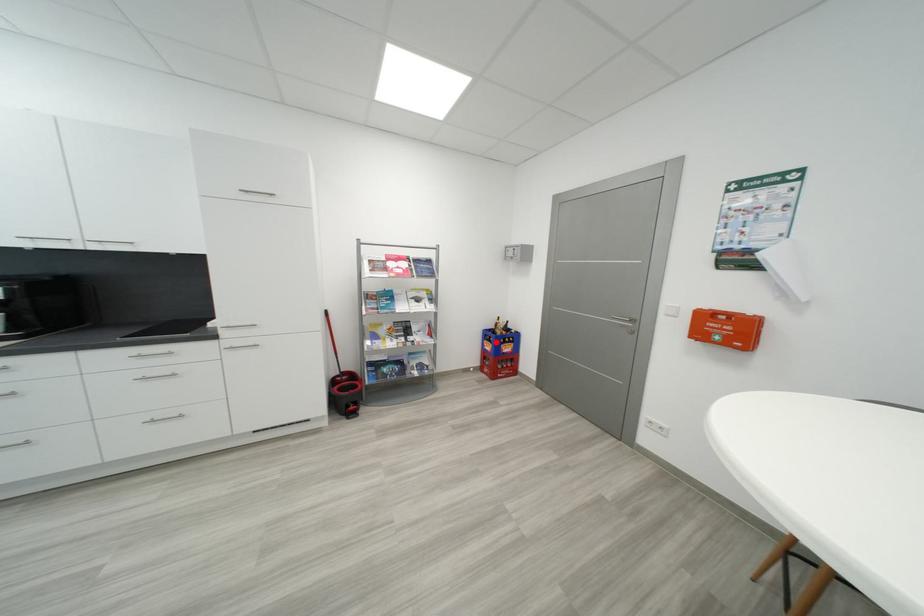
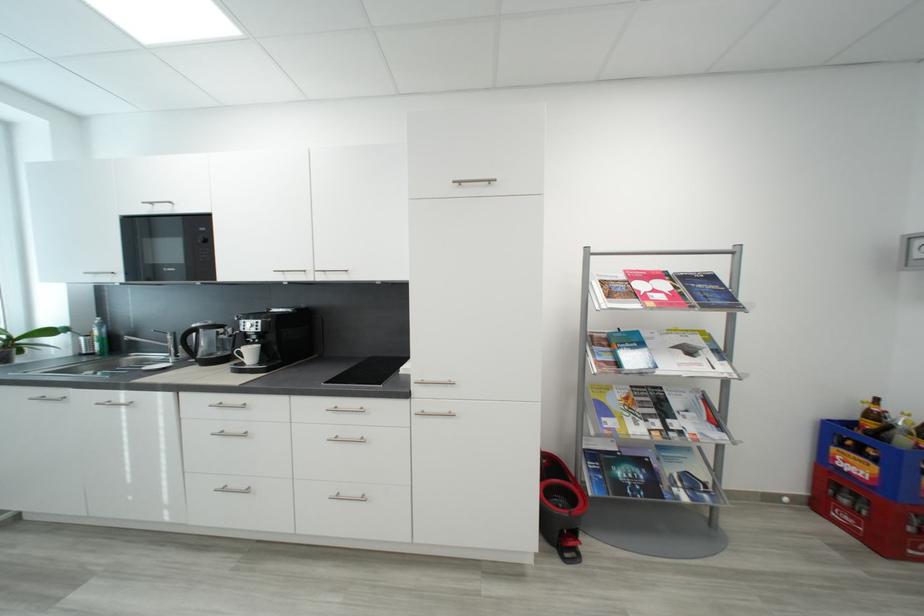
Question: I am providing you with two images of the same scene from different viewpoints. Given a red point in image1, look at the same physical point in image2. Is it:

Choices:
 (A) Closer to the viewpoint
 (B) Farther from the viewpoint

Answer: (A)